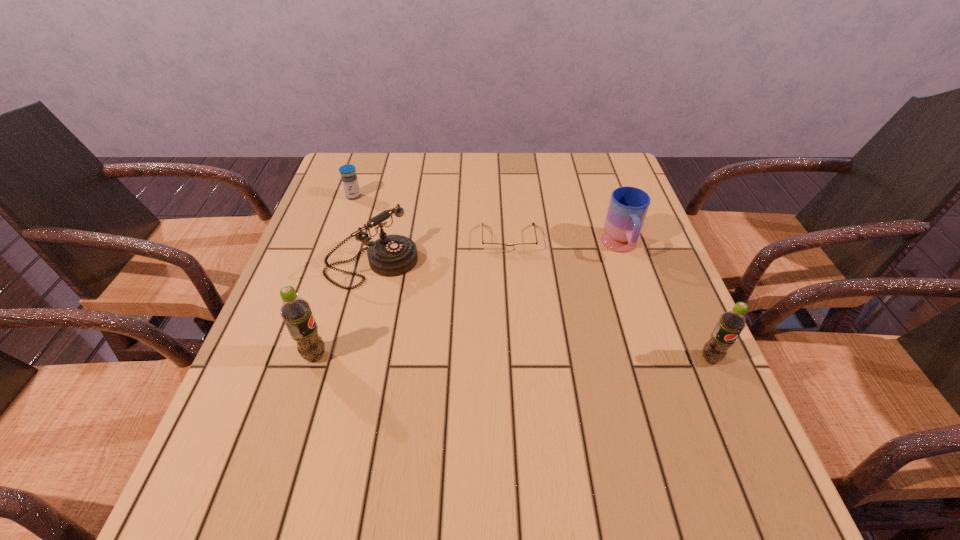
The height and width of the screenshot is (540, 960). Identify the location of the left soda. (296, 312).

Find the location of a particular element. This screenshot has height=540, width=960. the taller soda is located at coordinates (296, 312).

Identify the location of the rightmost object. (731, 323).

At what (x,y) coordinates should I click in order to perform the action: click on the shorter soda. Please return your answer as a coordinate pair (x, y). The image size is (960, 540). Looking at the image, I should click on (731, 323).

Identify the location of the second shortest object. (349, 179).

You are a GUI agent. You are given a task and a screenshot of the screen. Output one action in this format:
    pyautogui.click(x=<x>, y=<y>)
    Task: Click on the medicine
    This screenshot has height=540, width=960.
    Given the screenshot: What is the action you would take?
    pyautogui.click(x=349, y=179)

You are a GUI agent. You are given a task and a screenshot of the screen. Output one action in this format:
    pyautogui.click(x=<x>, y=<y>)
    Task: Click on the shortest object
    
    Given the screenshot: What is the action you would take?
    pyautogui.click(x=495, y=248)

Locate an element on the screen. spectacles is located at coordinates (495, 248).

You are a GUI agent. You are given a task and a screenshot of the screen. Output one action in this format:
    pyautogui.click(x=<x>, y=<y>)
    Task: Click on the telephone
    This screenshot has height=540, width=960.
    Given the screenshot: What is the action you would take?
    pyautogui.click(x=393, y=255)

Locate an element on the screen. the fifth object from left to right is located at coordinates (628, 206).